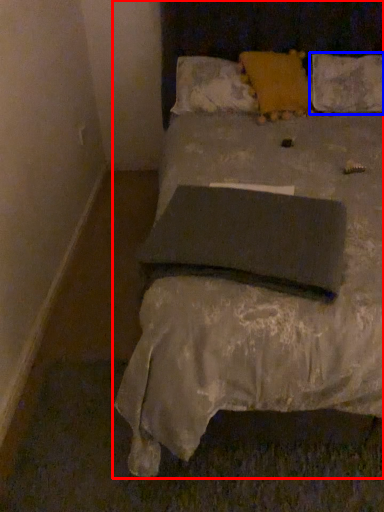
Question: Which object appears closest to the camera in this image, bed (highlighted by a red box) or pillow (highlighted by a blue box)?

Choices:
 (A) bed
 (B) pillow

Answer: (A)